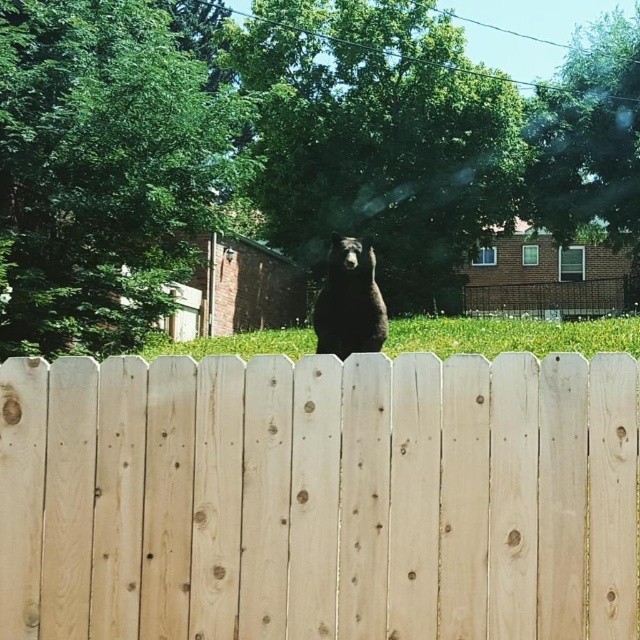
Is light brown wood fence at center smaller than black furry bear at center?

Incorrect, light brown wood fence at center is not smaller in size than black furry bear at center.

Does light brown wood fence at center appear over black furry bear at center?

Incorrect, light brown wood fence at center is not positioned above black furry bear at center.

Find the location of a particular element. light brown wood fence at center is located at coordinates (320, 497).